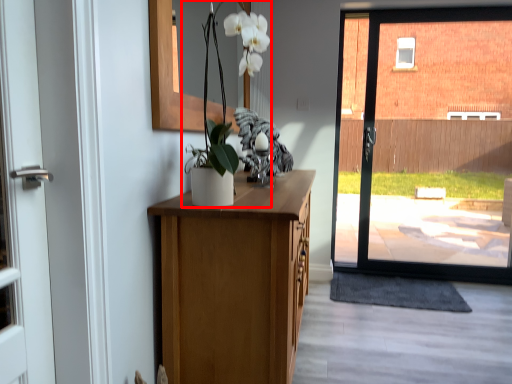
Question: From the image's perspective, what is the correct spatial relationship of floral arrangement (annotated by the red box) in relation to doormat?

Choices:
 (A) above
 (B) below

Answer: (A)